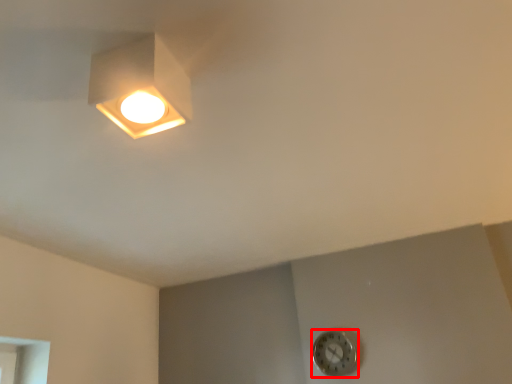
Question: Considering the relative positions of clock (annotated by the red box) and lamp in the image provided, where is clock (annotated by the red box) located with respect to the staircase?

Choices:
 (A) right
 (B) left

Answer: (A)